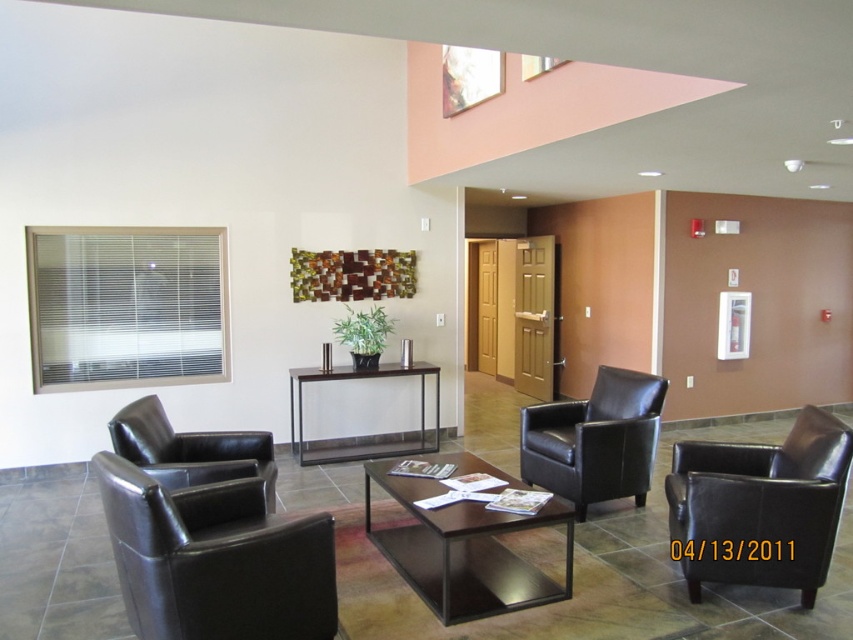
Question: Which of these objects is positioned closest to the dark brown wood coffee table at center?

Choices:
 (A) matte black armchair at left
 (B) metallic/reflective console table at center

Answer: (A)

Question: Estimate the real-world distances between objects in this image. Which object is farther from the black leather armchair at center?

Choices:
 (A) matte black armchair at left
 (B) dark brown wood coffee table at center

Answer: (A)

Question: Is matte black armchair at left positioned at the back of black leather chair at center?

Choices:
 (A) no
 (B) yes

Answer: (A)

Question: Is dark brown wood coffee table at center smaller than black leather armchair at center?

Choices:
 (A) no
 (B) yes

Answer: (A)

Question: Where is black leather armchair at center located in relation to metallic/reflective console table at center in the image?

Choices:
 (A) left
 (B) right

Answer: (B)

Question: Which point is farther to the camera?

Choices:
 (A) (583, 476)
 (B) (434, 448)
 (C) (532, 520)

Answer: (B)